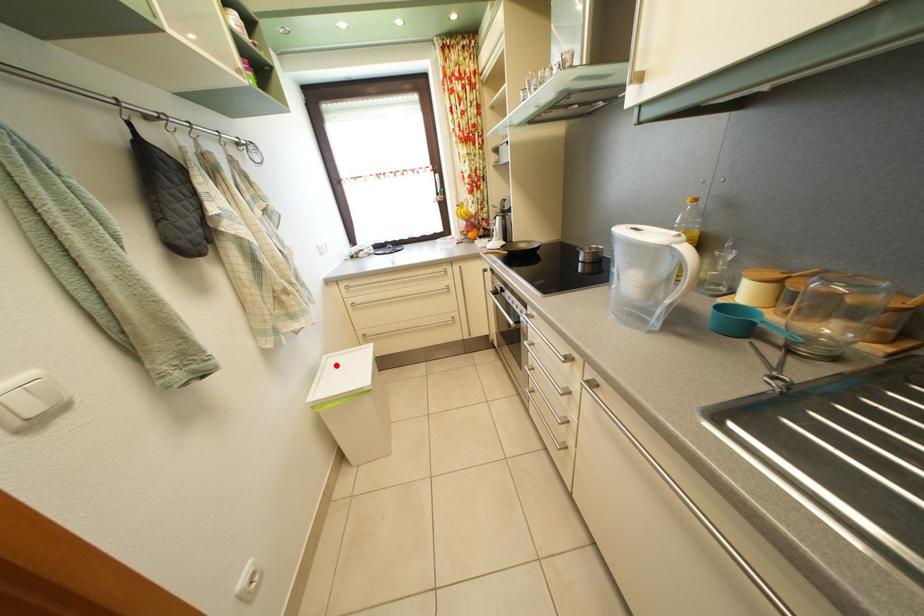
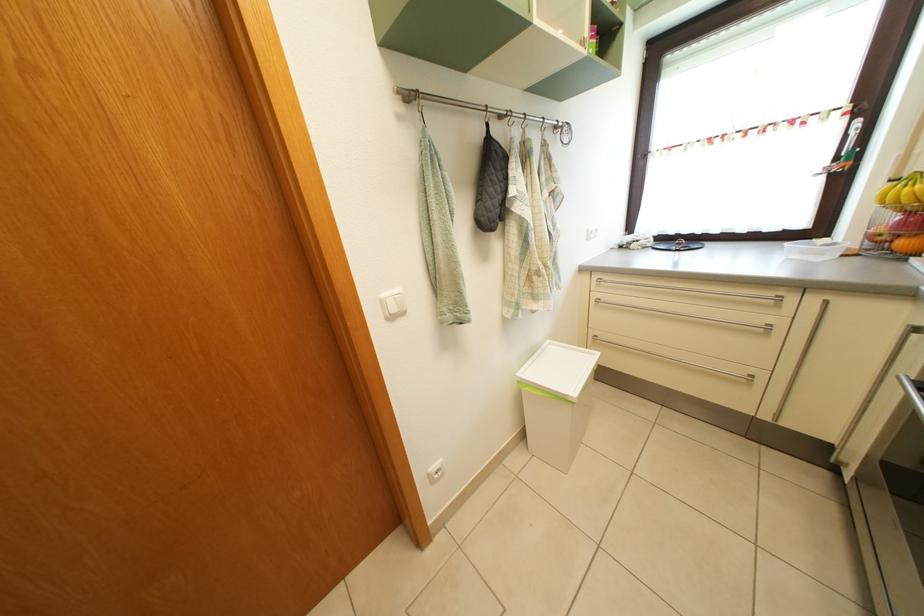
Question: I am providing you with two images of the same scene from different viewpoints. A red point is shown in image1. For the corresponding object point in image2, is it positioned nearer or farther from the camera?

Choices:
 (A) Nearer
 (B) Farther

Answer: (B)